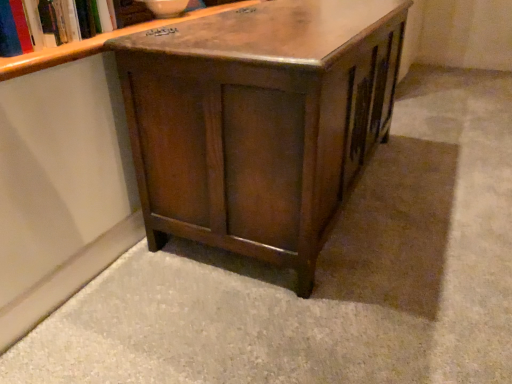
Identify the location of wooden bookshelf at upper left. (35, 25).

This screenshot has width=512, height=384. What do you see at coordinates (35, 25) in the screenshot? I see `wooden bookshelf at upper left` at bounding box center [35, 25].

What do you see at coordinates (259, 121) in the screenshot?
I see `wooden cabinet at center` at bounding box center [259, 121].

Identify the location of wooden cabinet at center. (259, 121).

Find the location of a particular element. The width and height of the screenshot is (512, 384). wooden bookshelf at upper left is located at coordinates (35, 25).

Considering the relative positions of wooden bookshelf at upper left and wooden cabinet at center in the image provided, is wooden bookshelf at upper left to the left or to the right of wooden cabinet at center?

In the image, wooden bookshelf at upper left appears on the left side of wooden cabinet at center.

Between wooden bookshelf at upper left and wooden cabinet at center, which one is positioned behind?

wooden bookshelf at upper left is behind.

Which is behind, point (49, 12) or point (251, 200)?

The point (251, 200) is behind.

From the image's perspective, is wooden bookshelf at upper left positioned above or below wooden cabinet at center?

From the image's perspective, wooden bookshelf at upper left appears above wooden cabinet at center.

From a real-world perspective, is wooden bookshelf at upper left located beneath wooden cabinet at center?

Incorrect, from a real-world perspective, wooden bookshelf at upper left is higher than wooden cabinet at center.

Is wooden bookshelf at upper left thinner than wooden cabinet at center?

Indeed, wooden bookshelf at upper left has a lesser width compared to wooden cabinet at center.

Does wooden bookshelf at upper left have a lesser height compared to wooden cabinet at center?

Indeed, wooden bookshelf at upper left has a lesser height compared to wooden cabinet at center.

Does wooden bookshelf at upper left have a larger size compared to wooden cabinet at center?

No, wooden bookshelf at upper left is not bigger than wooden cabinet at center.

Consider the image. Is wooden bookshelf at upper left located outside wooden cabinet at center?

Yes, wooden bookshelf at upper left is not within wooden cabinet at center.

Are wooden bookshelf at upper left and wooden cabinet at center making contact?

No.

Is wooden bookshelf at upper left looking in the opposite direction of wooden cabinet at center?

No, wooden bookshelf at upper left is not facing away from wooden cabinet at center.

Measure the distance between wooden bookshelf at upper left and wooden cabinet at center.

They are 16.67 inches apart.

Where is `book behind the wooden cabinet at center`? book behind the wooden cabinet at center is located at coordinates (35, 25).

Which is more to the right, wooden cabinet at center or wooden bookshelf at upper left?

wooden cabinet at center.

Which object is more forward, wooden cabinet at center or wooden bookshelf at upper left?

Positioned in front is wooden cabinet at center.

Which is less distant, (195, 209) or (66, 27)?

Point (66, 27)

From the image's perspective, which one is positioned lower, wooden cabinet at center or wooden bookshelf at upper left?

wooden cabinet at center is shown below in the image.

From a real-world perspective, is wooden cabinet at center on top of wooden bookshelf at upper left?

Actually, wooden cabinet at center is physically below wooden bookshelf at upper left in the real world.

Looking at this image, is wooden cabinet at center wider than wooden bookshelf at upper left?

Yes, wooden cabinet at center is wider than wooden bookshelf at upper left.

Which of these two, wooden cabinet at center or wooden bookshelf at upper left, stands shorter?

With less height is wooden bookshelf at upper left.

Is wooden cabinet at center bigger or smaller than wooden bookshelf at upper left?

In the image, wooden cabinet at center appears to be larger than wooden bookshelf at upper left.

Choose the correct answer: Is wooden cabinet at center inside wooden bookshelf at upper left or outside it?

wooden cabinet at center is located beyond the bounds of wooden bookshelf at upper left.

Is wooden cabinet at center in contact with wooden bookshelf at upper left?

No.

Could you tell me if wooden cabinet at center is facing wooden bookshelf at upper left?

No.

Can you tell me how much wooden cabinet at center and wooden bookshelf at upper left differ in facing direction?

The angle between the facing direction of wooden cabinet at center and the facing direction of wooden bookshelf at upper left is 0.000955 degrees.

How far apart are wooden cabinet at center and wooden bookshelf at upper left?

They are 16.67 inches apart.

In order to click on book located on the left of wooden cabinet at center in this screenshot , I will do `click(35, 25)`.

This screenshot has width=512, height=384. Find the location of `book on the left of wooden cabinet at center`. book on the left of wooden cabinet at center is located at coordinates (35, 25).

Where is `table directly beneath the wooden bookshelf at upper left (from a real-world perspective)`? table directly beneath the wooden bookshelf at upper left (from a real-world perspective) is located at coordinates (259, 121).